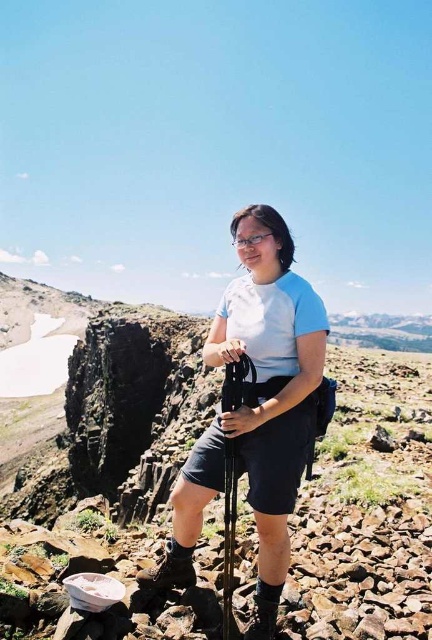
You are a photographer aiming to capture the person in the scene. You want to ensure the blue fabric shirt at center and the black matte ski pole at center are both visible in your shot. Based on their positions, which object should you focus on first to frame them properly?

The blue fabric shirt at center is to the left of the black matte ski pole at center, so you should focus on the blue fabric shirt at center first to ensure both are framed correctly.

You are a photographer trying to capture a clear shot of the blue fabric shirt at center and the black matte ski pole at center. Since you want to focus on the shirt, which object should you adjust your camera lens to prioritize in terms of size in the frame?

The blue fabric shirt at center has a greater height compared to the black matte ski pole at center, so you should adjust your camera lens to prioritize the blue fabric shirt at center as it is taller and will naturally take up more space in the frame.

Where is the blue fabric shirt at center located in the image?

The blue fabric shirt at center is located at point (256, 408) in the image.